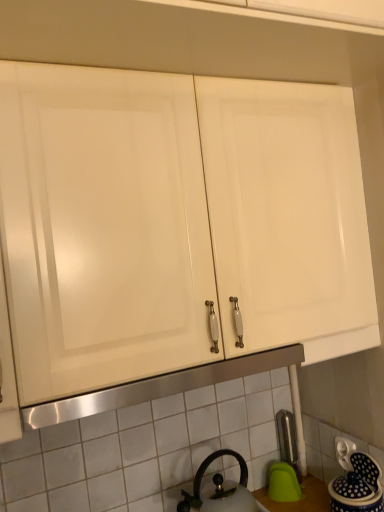
Measure the distance between point (235,456) and camera.

1.27 meters.

What do you see at coordinates (219, 490) in the screenshot?
I see `black matte kettle at lower center` at bounding box center [219, 490].

Image resolution: width=384 pixels, height=512 pixels. What are the coordinates of `white tile at center` in the screenshot? It's located at (144, 449).

Identify the location of white plastic electric outlet at lower right. Image resolution: width=384 pixels, height=512 pixels. pos(344,452).

Measure the distance between point (x=346, y=463) and camera.

The distance of point (x=346, y=463) from camera is 1.17 meters.

Image resolution: width=384 pixels, height=512 pixels. Describe the element at coordinates (357, 485) in the screenshot. I see `blue glazed ceramic jar at lower right` at that location.

Where is `satin nickel faucet at lower right`? The image size is (384, 512). satin nickel faucet at lower right is located at coordinates (288, 440).

This screenshot has width=384, height=512. I want to click on black matte kettle at lower center, so [219, 490].

How far apart are blue glazed ceramic jar at lower right and white plastic electric outlet at lower right?

They are 2.03 inches apart.

Consider the image. Considering the positions of objects blue glazed ceramic jar at lower right and white plastic electric outlet at lower right in the image provided, who is behind, blue glazed ceramic jar at lower right or white plastic electric outlet at lower right?

white plastic electric outlet at lower right is further away from the camera.

Who is bigger, blue glazed ceramic jar at lower right or white plastic electric outlet at lower right?

blue glazed ceramic jar at lower right.

Visually, is blue glazed ceramic jar at lower right positioned to the left or to the right of white plastic electric outlet at lower right?

blue glazed ceramic jar at lower right is to the left of white plastic electric outlet at lower right.

Is white plastic electric outlet at lower right facing towards black matte kettle at lower center?

Yes, white plastic electric outlet at lower right is aimed at black matte kettle at lower center.

Is black matte kettle at lower center located within white plastic electric outlet at lower right?

No.

Considering the sizes of objects white plastic electric outlet at lower right and black matte kettle at lower center in the image provided, who is bigger, white plastic electric outlet at lower right or black matte kettle at lower center?

black matte kettle at lower center is bigger.

Does point (341, 446) appear closer or farther from the camera than point (210, 504)?

Point (341, 446) is farther from the camera than point (210, 504).

Is white tile at center at the right side of satin nickel faucet at lower right?

No.

Is white tile at center wider or thinner than satin nickel faucet at lower right?

Clearly, white tile at center has less width compared to satin nickel faucet at lower right.

Could you tell me if white tile at center is turned towards satin nickel faucet at lower right?

Yes, white tile at center is oriented towards satin nickel faucet at lower right.

Considering the relative sizes of white tile at center and satin nickel faucet at lower right in the image provided, is white tile at center smaller than satin nickel faucet at lower right?

Incorrect, white tile at center is not smaller in size than satin nickel faucet at lower right.

From the image's perspective, which object appears higher, satin nickel faucet at lower right or white plastic electric outlet at lower right?

From the image's view, white plastic electric outlet at lower right is above.

Considering the points (299, 470) and (348, 453), which point is behind, point (299, 470) or point (348, 453)?

The point (299, 470) is more distant.

Is satin nickel faucet at lower right looking in the opposite direction of white plastic electric outlet at lower right?

That's not correct — satin nickel faucet at lower right is not looking away from white plastic electric outlet at lower right.

Between satin nickel faucet at lower right and white plastic electric outlet at lower right, which one has more height?

Standing taller between the two is satin nickel faucet at lower right.

Considering the relative sizes of satin nickel faucet at lower right and black matte kettle at lower center in the image provided, is satin nickel faucet at lower right smaller than black matte kettle at lower center?

Correct, satin nickel faucet at lower right occupies less space than black matte kettle at lower center.

Considering the sizes of objects satin nickel faucet at lower right and black matte kettle at lower center in the image provided, who is shorter, satin nickel faucet at lower right or black matte kettle at lower center?

Standing shorter between the two is black matte kettle at lower center.

Is satin nickel faucet at lower right not near black matte kettle at lower center?

No, satin nickel faucet at lower right is not far from black matte kettle at lower center.

From the image's perspective, which is below, satin nickel faucet at lower right or black matte kettle at lower center?

From the image's view, black matte kettle at lower center is below.

Would you say blue glazed ceramic jar at lower right is a long distance from white tile at center?

blue glazed ceramic jar at lower right is near white tile at center, not far away.

Which is closer to the camera, (368, 502) or (9, 447)?

Clearly, point (368, 502) is more distant from the camera than point (9, 447).

Who is shorter, blue glazed ceramic jar at lower right or white tile at center?

blue glazed ceramic jar at lower right is shorter.

From the image's perspective, is blue glazed ceramic jar at lower right located above or below white tile at center?

blue glazed ceramic jar at lower right is below white tile at center.

Looking at this image, from the image's perspective, who appears lower, black matte kettle at lower center or white tile at center?

black matte kettle at lower center, from the image's perspective.

Between black matte kettle at lower center and white tile at center, which one has larger size?

white tile at center.

Considering the sizes of black matte kettle at lower center and white tile at center in the image, is black matte kettle at lower center taller or shorter than white tile at center?

In the image, black matte kettle at lower center appears to be shorter than white tile at center.

Measure the distance from black matte kettle at lower center to white tile at center.

black matte kettle at lower center and white tile at center are 6.82 inches apart from each other.

Locate an element on the screen. The height and width of the screenshot is (512, 384). electric outlet to the right of blue glazed ceramic jar at lower right is located at coordinates (344, 452).

What are the coordinates of `kettle in front of the white plastic electric outlet at lower right` in the screenshot? It's located at (219, 490).

Which object lies further to the anchor point white plastic electric outlet at lower right, black matte kettle at lower center or satin nickel faucet at lower right?

Among the two, black matte kettle at lower center is located further to white plastic electric outlet at lower right.

Estimate the real-world distances between objects in this image. Which object is further from white tile at center, black matte kettle at lower center or satin nickel faucet at lower right?

Based on the image, satin nickel faucet at lower right appears to be further to white tile at center.

In the scene shown: Based on their spatial positions, is satin nickel faucet at lower right or blue glazed ceramic jar at lower right closer to black matte kettle at lower center?

satin nickel faucet at lower right lies closer to black matte kettle at lower center than the other object.

Which object lies nearer to the anchor point black matte kettle at lower center, blue glazed ceramic jar at lower right or white plastic electric outlet at lower right?

blue glazed ceramic jar at lower right is closer to black matte kettle at lower center.

Considering their positions, is blue glazed ceramic jar at lower right positioned further to satin nickel faucet at lower right than black matte kettle at lower center?

blue glazed ceramic jar at lower right is further to satin nickel faucet at lower right.

When comparing their distances from white plastic electric outlet at lower right, does white tile at center or blue glazed ceramic jar at lower right seem further?

white tile at center.

Looking at the image, which one is located further to white plastic electric outlet at lower right, white tile at center or satin nickel faucet at lower right?

white tile at center is further to white plastic electric outlet at lower right.

Consider the image. From the image, which object appears to be farther from satin nickel faucet at lower right, black matte kettle at lower center or white tile at center?

white tile at center lies further to satin nickel faucet at lower right than the other object.

This screenshot has width=384, height=512. In order to click on kettle between white tile at center and blue glazed ceramic jar at lower right in this screenshot , I will do `click(219, 490)`.

The width and height of the screenshot is (384, 512). I want to click on appliance positioned between black matte kettle at lower center and satin nickel faucet at lower right from near to far, so click(x=357, y=485).

Locate an element on the screen. electric outlet between blue glazed ceramic jar at lower right and satin nickel faucet at lower right from front to back is located at coordinates (344, 452).

What are the coordinates of `appliance situated between white tile at center and white plastic electric outlet at lower right from left to right` in the screenshot? It's located at (357, 485).